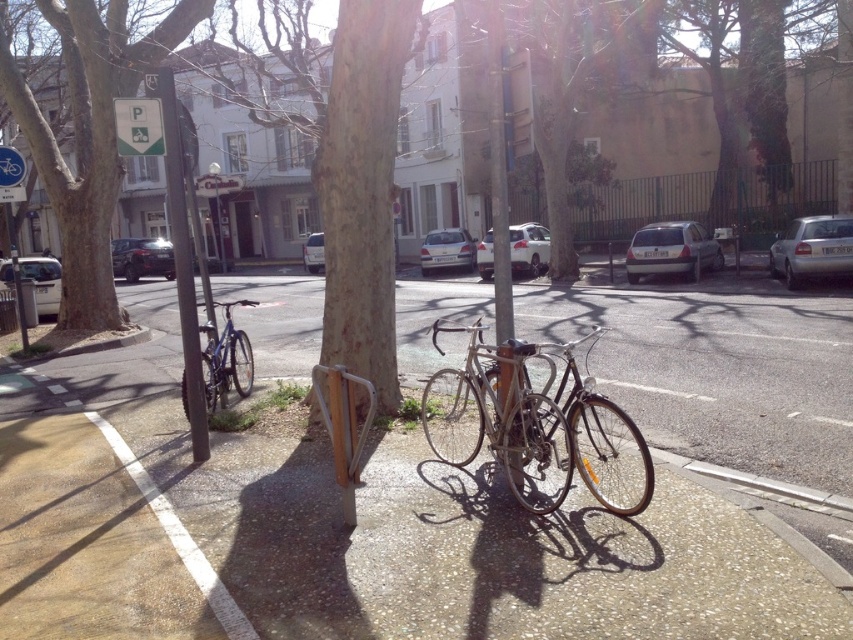
You are a delivery person who needs to place a package between the smooth brown tree trunk at center and the green plastic parking sign at upper left. The package is 7 feet long. Can you fit it between them without moving either object?

The distance between the smooth brown tree trunk at center and the green plastic parking sign at upper left is 6.97 feet. Since the package is 7 feet long, it is slightly longer than the available space, so it won

You are a pedestrian trying to read the green plastic parking sign at upper left. The smooth brown tree trunk at center is blocking your view. Can you move around the tree trunk to see the sign?

The green plastic parking sign at upper left is behind the smooth brown tree trunk at center, so moving around the tree trunk might allow you to see the sign if there is a clear path.